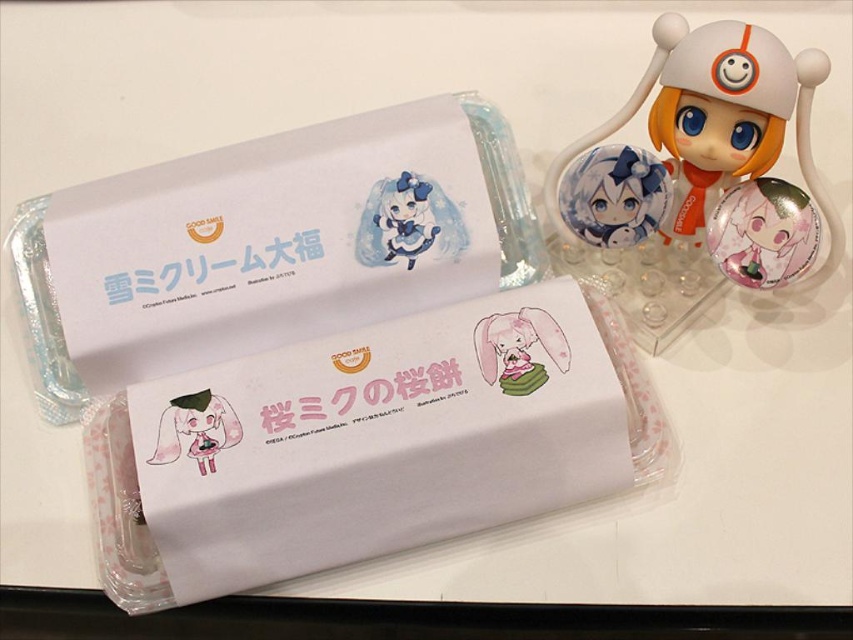
In the scene shown: You are standing at the origin point in the center of the image. You want to walk towards the point labeled as point (x=204, y=419). Will you pass by point (x=514, y=385) before reaching your destination?

No, because point (x=514, y=385) is behind point (x=204, y=419), so you will reach point (x=204, y=419) first without passing by point (x=514, y=385).

You are organizing a display of items on a white surface. You have a pink matte plush rabbit at center and a pink glossy plushie at center. Which one is placed higher up?

The pink matte plush rabbit at center is positioned over the pink glossy plushie at center, so it is placed higher up.